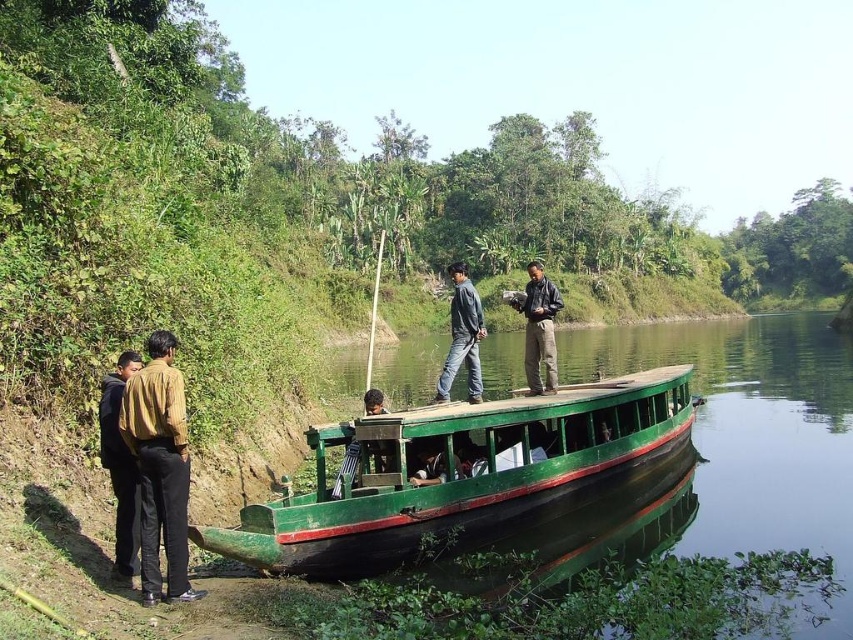
You are standing on the riverbank and want to board the green matte boat at center. Which direction should you walk to reach it?

You should walk towards the center of the riverbank to reach the green matte boat at center, as it is located at point (459, 474).

You are a traveler standing on the riverside bank and see the dark blue jeans at center and the leather jacket at center. Which item is closer to the ground?

The dark blue jeans at center is located below leather jacket at center, so it is closer to the ground.

You are planning to carry a brown cotton shirt at left on a green matte boat at center. Can the shirt fit inside the boat?

The green matte boat at center might be wider than brown cotton shirt at left, so the shirt should fit inside the boat.